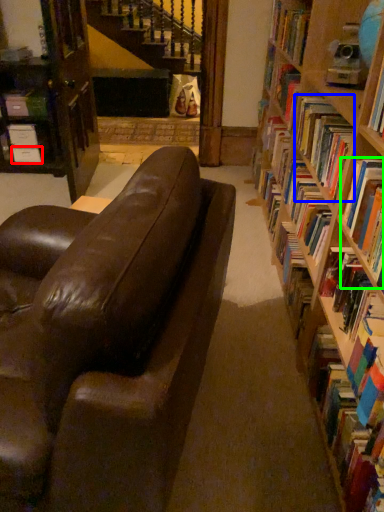
Question: Which is nearer to the paperback book (highlighted by a red box)? book (highlighted by a blue box) or book (highlighted by a green box).

Choices:
 (A) book
 (B) book

Answer: (A)